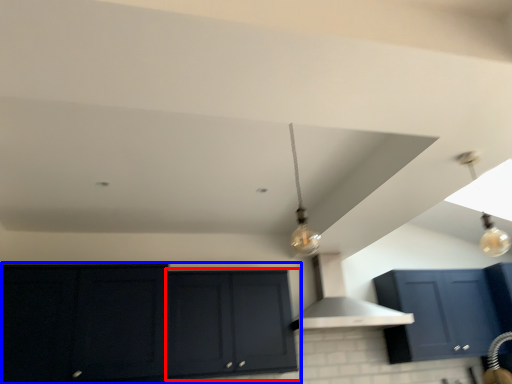
Question: Which object is closer to the camera taking this photo, cabinetry (highlighted by a red box) or cabinetry (highlighted by a blue box)?

Choices:
 (A) cabinetry
 (B) cabinetry

Answer: (B)